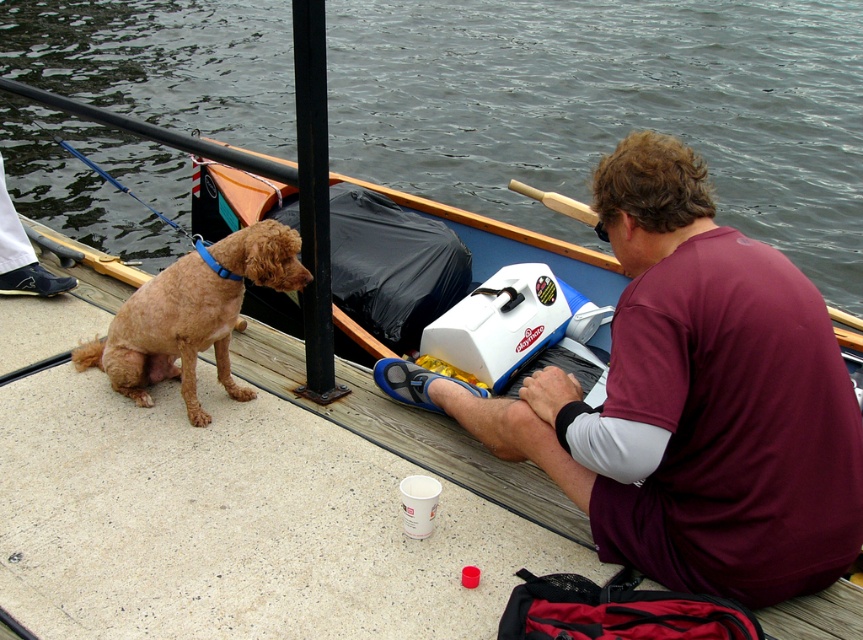
Question: Does brown fur dog at left have a lesser width compared to smooth concrete dock at center?

Choices:
 (A) no
 (B) yes

Answer: (A)

Question: Does shiny brown fur at left come behind black metal pole at center?

Choices:
 (A) no
 (B) yes

Answer: (B)

Question: Among these objects, which one is nearest to the camera?

Choices:
 (A) smooth concrete dock at center
 (B) shiny brown fur at left

Answer: (A)

Question: Does brown fur dog at left have a lesser width compared to maroon fabric shirt at center?

Choices:
 (A) no
 (B) yes

Answer: (A)

Question: Which point is closer to the camera?

Choices:
 (A) (210, 12)
 (B) (761, 502)

Answer: (B)

Question: Among these objects, which one is farthest from the camera?

Choices:
 (A) shiny brown fur at left
 (B) black metal pole at center

Answer: (A)